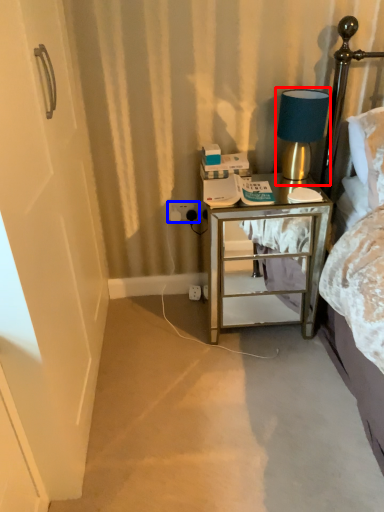
Question: Which of the following is the closest to the observer, table lamp (highlighted by a red box) or electric outlet (highlighted by a blue box)?

Choices:
 (A) table lamp
 (B) electric outlet

Answer: (A)